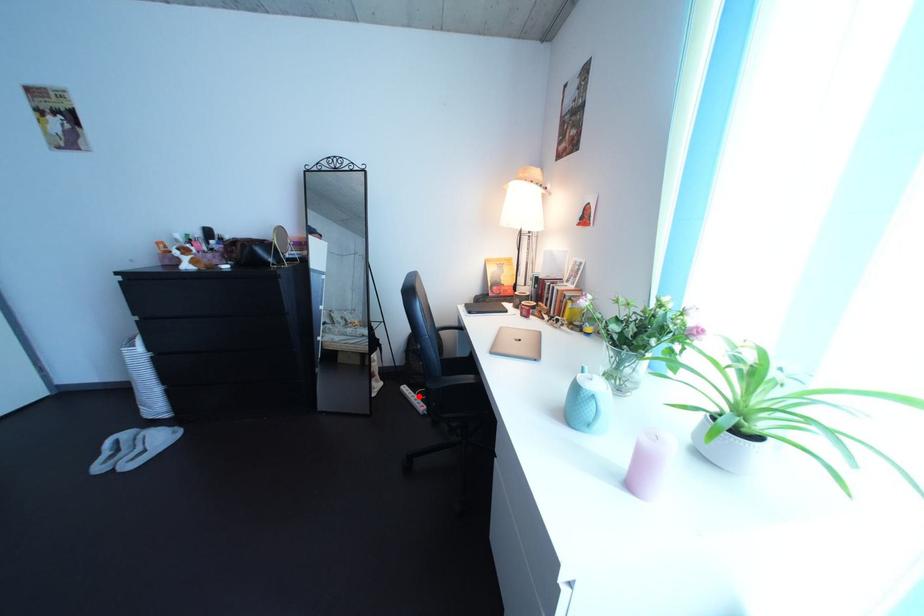
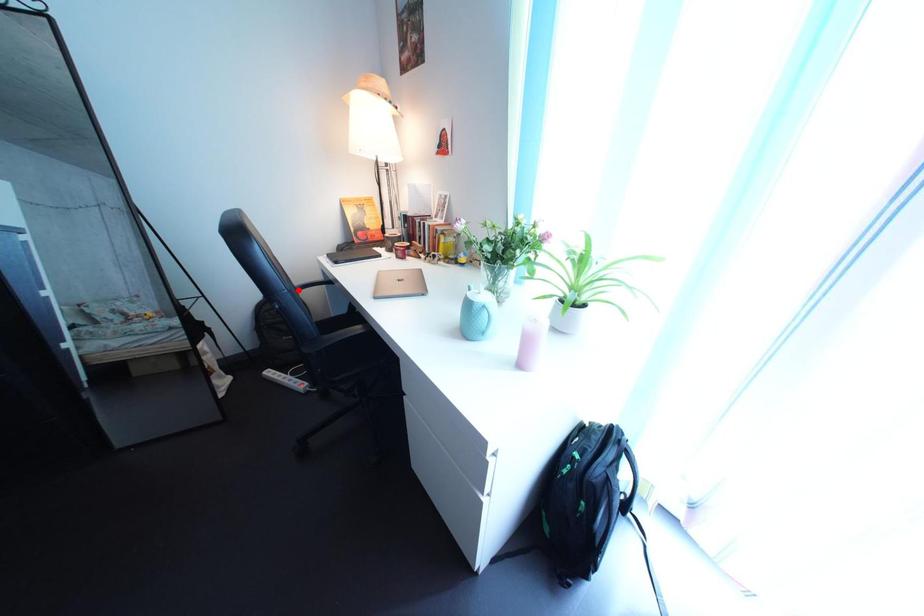
I am providing you with two images of the same scene from different viewpoints. A red point is marked on the first image and another point is marked on the second image. Are the points marked in image1 and image2 representing the same 3D position?

No